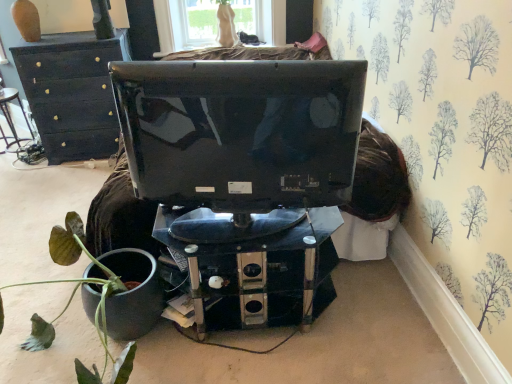
Question: Is transparent glass window at upper center wider than metallic black computer desk at center?

Choices:
 (A) no
 (B) yes

Answer: (A)

Question: Is transparent glass window at upper center oriented towards metallic black computer desk at center?

Choices:
 (A) no
 (B) yes

Answer: (B)

Question: From a real-world perspective, is transparent glass window at upper center physically above metallic black computer desk at center?

Choices:
 (A) no
 (B) yes

Answer: (B)

Question: Is transparent glass window at upper center outside of metallic black computer desk at center?

Choices:
 (A) no
 (B) yes

Answer: (B)

Question: Does transparent glass window at upper center have a greater height compared to metallic black computer desk at center?

Choices:
 (A) yes
 (B) no

Answer: (B)

Question: Does transparent glass window at upper center come in front of metallic black computer desk at center?

Choices:
 (A) no
 (B) yes

Answer: (A)

Question: Can we say glossy black monitor at center lies outside metallic silver chair at left?

Choices:
 (A) yes
 (B) no

Answer: (A)

Question: Can you see glossy black monitor at center touching metallic silver chair at left?

Choices:
 (A) yes
 (B) no

Answer: (B)

Question: Could you tell me if glossy black monitor at center is facing metallic silver chair at left?

Choices:
 (A) no
 (B) yes

Answer: (A)

Question: Does glossy black monitor at center come behind metallic silver chair at left?

Choices:
 (A) yes
 (B) no

Answer: (B)

Question: Is glossy black monitor at center wider than metallic silver chair at left?

Choices:
 (A) no
 (B) yes

Answer: (A)

Question: Is glossy black monitor at center at the left side of metallic silver chair at left?

Choices:
 (A) no
 (B) yes

Answer: (A)

Question: Considering the relative sizes of green matte plant pot at lower left and glossy black monitor at center in the image provided, is green matte plant pot at lower left bigger than glossy black monitor at center?

Choices:
 (A) yes
 (B) no

Answer: (A)